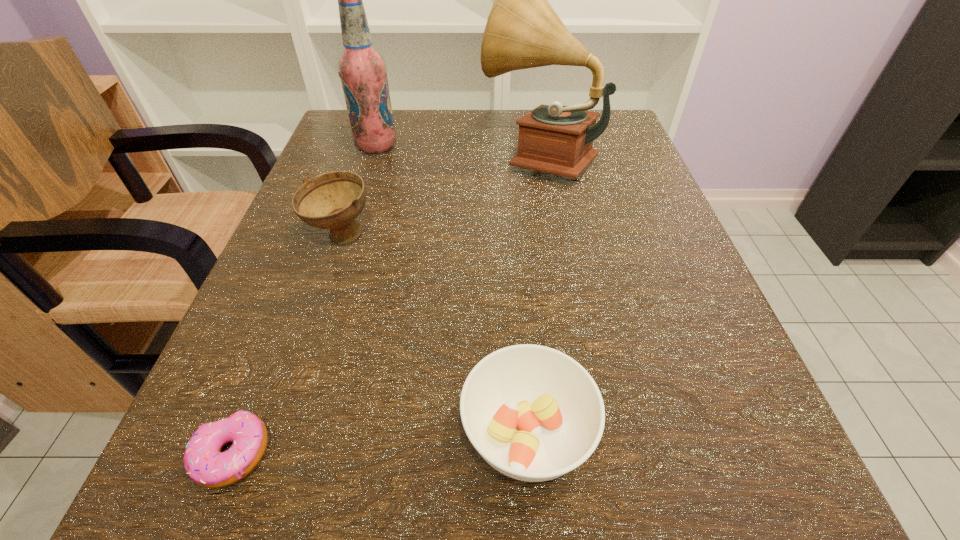
Identify the location of the third closest object relative to the alcohol. This screenshot has height=540, width=960. (533, 413).

Find the location of a particular element. The image size is (960, 540). vacant area that satisfies the following two spatial constraints: 1. on the horn of the phonograph record; 2. on the front side of the left soup bowl is located at coordinates (552, 237).